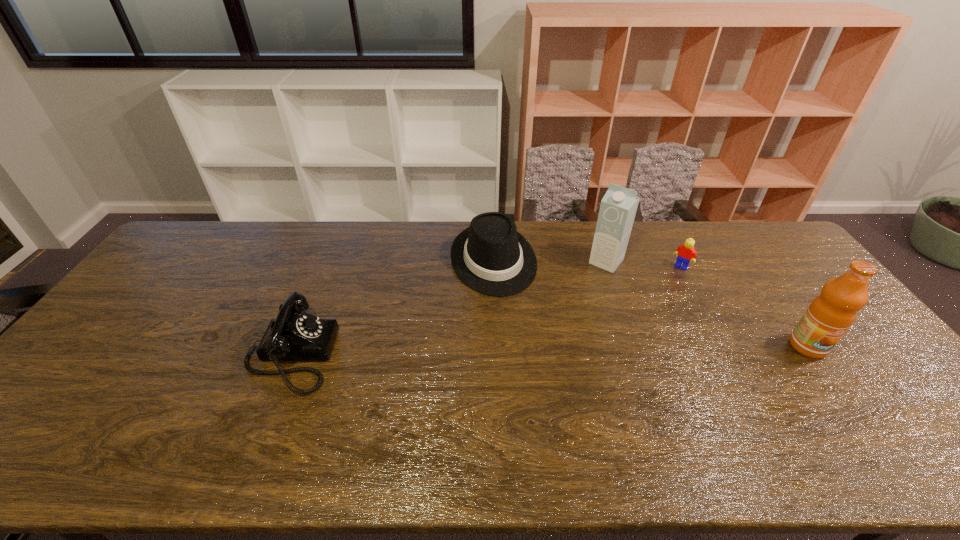
Identify the location of free space on the desktop that is between the telephone and the rightmost object and is positioned on the front-facing side of the fedora. This screenshot has height=540, width=960. (527, 350).

The height and width of the screenshot is (540, 960). I want to click on vacant space on the desktop that is between the leftmost object and the fruit juice and is positioned on the front-facing side of the shortest object, so click(613, 349).

Where is `free spot on the desktop that is between the telephone and the rightmost object and is positioned on the front label of the carton`? The height and width of the screenshot is (540, 960). free spot on the desktop that is between the telephone and the rightmost object and is positioned on the front label of the carton is located at coordinates (532, 350).